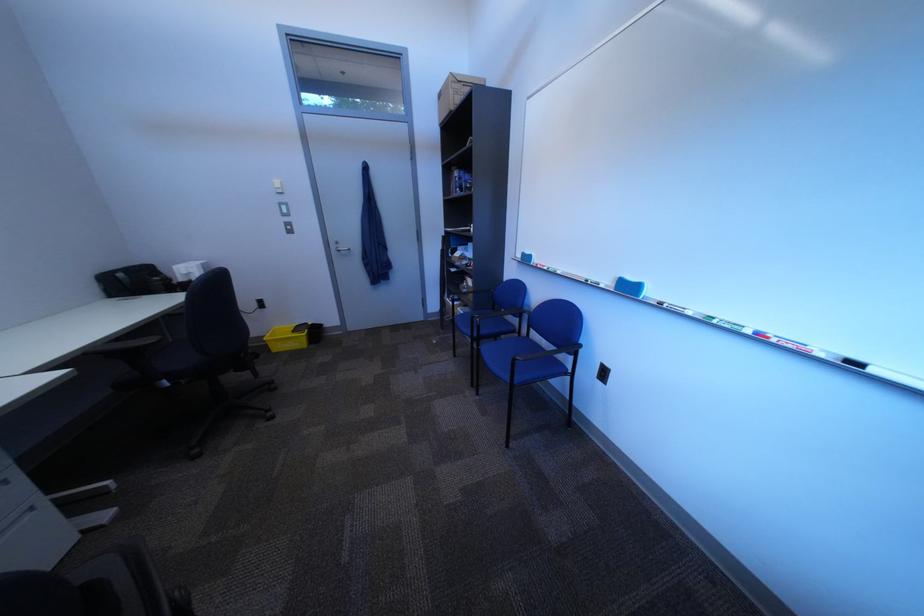
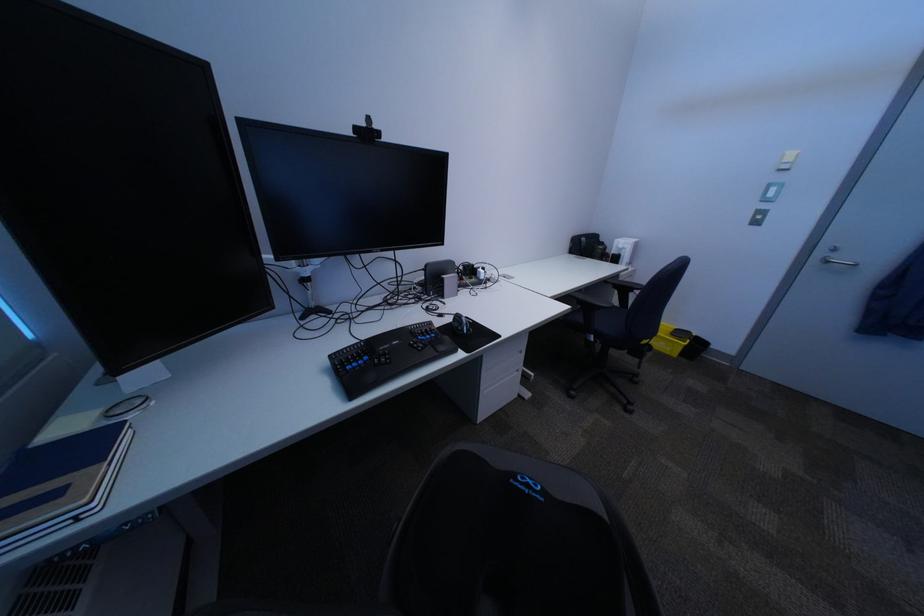
In the second image, find the point that corresponds to the point at 348,248 in the first image.

(834, 254)